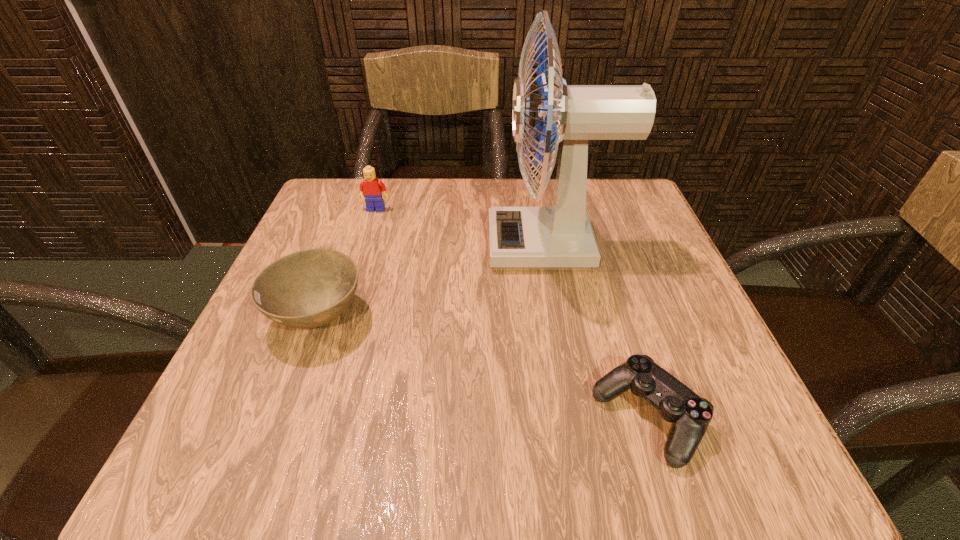
Find the location of `free space located 0.250m on the left of the control`. free space located 0.250m on the left of the control is located at coordinates (414, 418).

Where is `fan situated at the far edge`? fan situated at the far edge is located at coordinates (559, 237).

Locate an element on the screen. The height and width of the screenshot is (540, 960). Lego at the far edge is located at coordinates (371, 188).

Where is `object situated at the near edge`? The height and width of the screenshot is (540, 960). object situated at the near edge is located at coordinates (690, 414).

What are the coordinates of `Lego positioned at the left edge` in the screenshot? It's located at (371, 188).

Where is `bowl situated at the left edge`? The image size is (960, 540). bowl situated at the left edge is located at coordinates (310, 288).

The width and height of the screenshot is (960, 540). Identify the location of fan that is positioned at the right edge. (559, 237).

At what (x,y) coordinates should I click in order to perform the action: click on control that is at the right edge. Please return your answer as a coordinate pair (x, y). Image resolution: width=960 pixels, height=540 pixels. Looking at the image, I should click on (690, 414).

Find the location of a particular element. This screenshot has height=540, width=960. object at the far left corner is located at coordinates (371, 188).

Where is `object that is at the far right corner`? This screenshot has width=960, height=540. object that is at the far right corner is located at coordinates (559, 237).